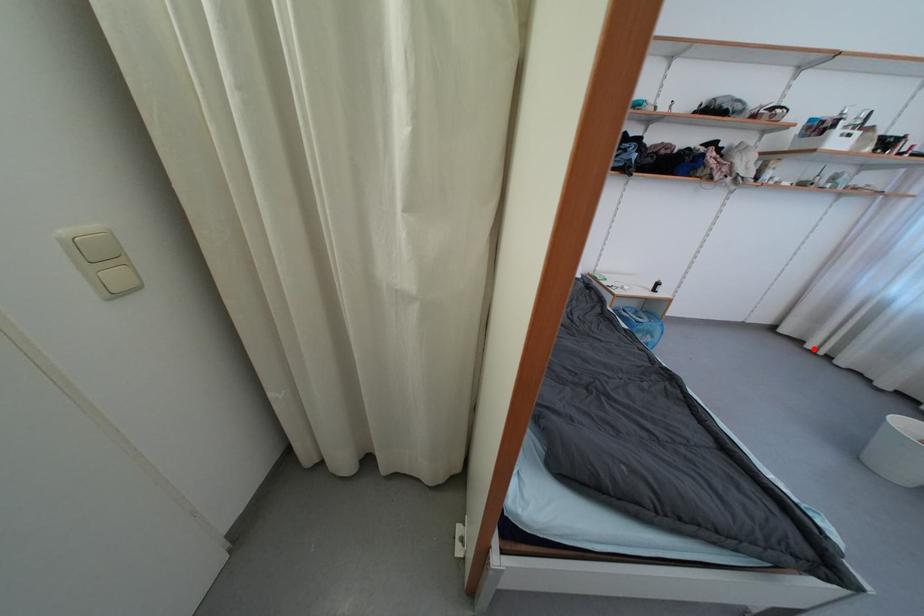
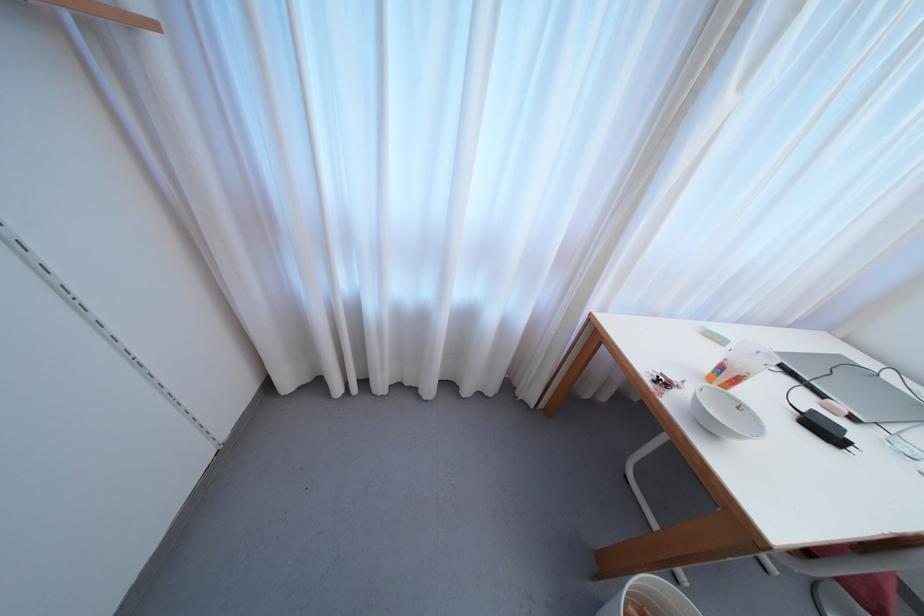
Question: I am providing you with two images of the same scene from different viewpoints. Image1 has a red point marked. In image2, the corresponding 3D location appears at what relative position? Reply with the corresponding letter.

Choices:
 (A) Closer
 (B) Farther

Answer: (B)